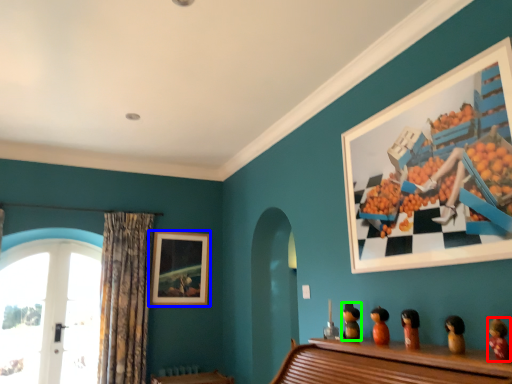
Question: Based on their relative distances, which object is nearer to toy (highlighted by a red box)? Choose from picture frame (highlighted by a blue box) and toy (highlighted by a green box).

Choices:
 (A) picture frame
 (B) toy

Answer: (B)